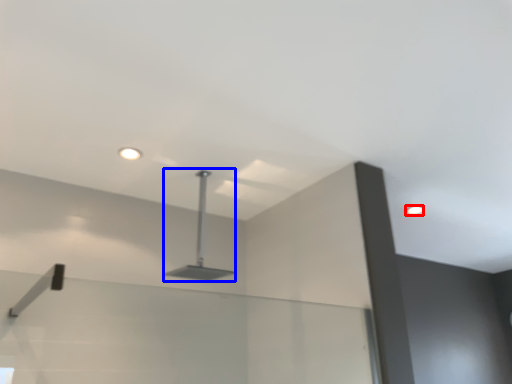
Question: Among these objects, which one is nearest to the camera, droplight (highlighted by a red box) or lamp (highlighted by a blue box)?

Choices:
 (A) droplight
 (B) lamp

Answer: (B)